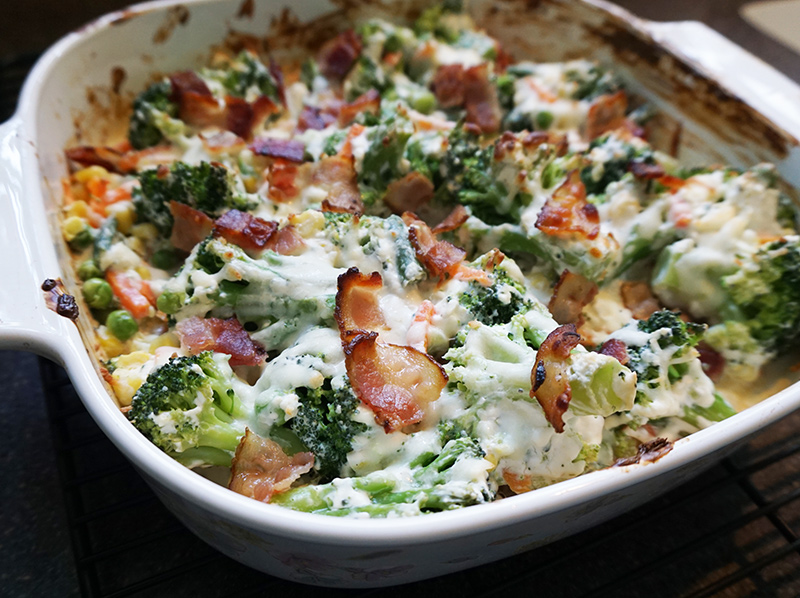
Locate an element on the screen. This screenshot has width=800, height=598. casserole is located at coordinates (466, 185).